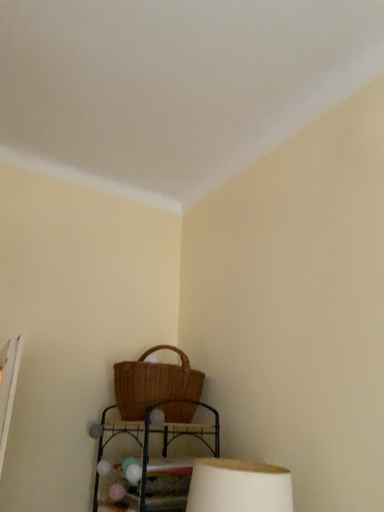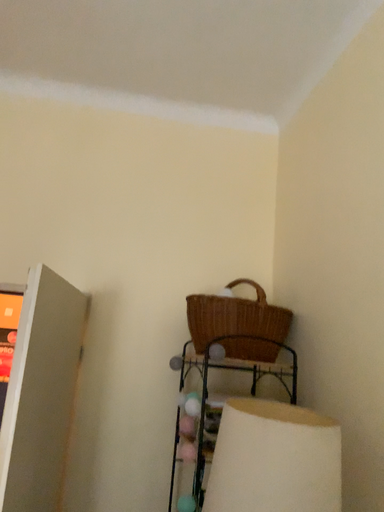
Question: How did the camera likely rotate when shooting the video?

Choices:
 (A) rotated upward
 (B) rotated downward

Answer: (B)